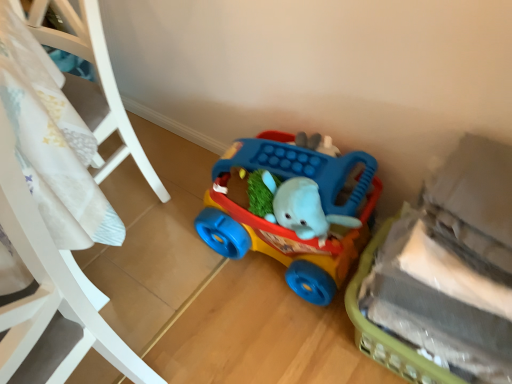
Where is `white plastic crib at left`? white plastic crib at left is located at coordinates (51, 219).

Does plush gray elephant at lower right, marked as the first toy in a front-to-back arrangement, have a greater width compared to white plastic crib at left?

No.

Consider the image. Is plush gray elephant at lower right, marked as the first toy in a front-to-back arrangement, at the left side of white plastic crib at left?

In fact, plush gray elephant at lower right, marked as the first toy in a front-to-back arrangement, is to the right of white plastic crib at left.

From a real-world perspective, between plush gray elephant at lower right, marked as the first toy in a front-to-back arrangement, and white plastic crib at left, who is vertically lower?

plush gray elephant at lower right, marked as the first toy in a front-to-back arrangement.

Which point is more distant from viewer, (448,174) or (54,86)?

The point (54,86) is behind.

Can we say rubberized plastic walker at center, the first toy when ordered from back to front, lies outside plush gray elephant at lower right, marked as the first toy in a front-to-back arrangement?

Yes.

Is rubberized plastic walker at center, the first toy when ordered from back to front, not near plush gray elephant at lower right, arranged as the second toy when viewed from the back?

No, rubberized plastic walker at center, the first toy when ordered from back to front, is not far away from plush gray elephant at lower right, arranged as the second toy when viewed from the back.

Is rubberized plastic walker at center, the first toy when ordered from back to front, oriented away from plush gray elephant at lower right, arranged as the second toy when viewed from the back?

rubberized plastic walker at center, the first toy when ordered from back to front, is not turned away from plush gray elephant at lower right, arranged as the second toy when viewed from the back.

Based on the photo, from the image's perspective, which object appears higher, rubberized plastic walker at center, the first toy when ordered from back to front, or plush gray elephant at lower right, arranged as the second toy when viewed from the back?

rubberized plastic walker at center, the first toy when ordered from back to front, from the image's perspective.

Which object is more forward, rubberized plastic walker at center, which is the 2th toy in front-to-back order, or white plastic crib at left?

white plastic crib at left.

Is rubberized plastic walker at center, the first toy when ordered from back to front, turned away from white plastic crib at left?

No, rubberized plastic walker at center, the first toy when ordered from back to front,'s orientation is not away from white plastic crib at left.

In terms of size, does rubberized plastic walker at center, which is the 2th toy in front-to-back order, appear bigger or smaller than white plastic crib at left?

In the image, rubberized plastic walker at center, which is the 2th toy in front-to-back order, appears to be smaller than white plastic crib at left.

Consider the image. Is white plastic crib at left oriented away from rubberized plastic walker at center, the first toy when ordered from back to front?

Yes, rubberized plastic walker at center, the first toy when ordered from back to front, is at the back of white plastic crib at left.

Is white plastic crib at left to the right of rubberized plastic walker at center, the first toy when ordered from back to front, from the viewer's perspective?

No.

Is white plastic crib at left in front of rubberized plastic walker at center, which is the 2th toy in front-to-back order?

Yes, it is in front of rubberized plastic walker at center, which is the 2th toy in front-to-back order.

Does point (79, 274) lie in front of point (360, 151)?

Yes.

Is plush gray elephant at lower right, marked as the first toy in a front-to-back arrangement, wider or thinner than rubberized plastic walker at center, the first toy when ordered from back to front?

In the image, plush gray elephant at lower right, marked as the first toy in a front-to-back arrangement, appears to be wider than rubberized plastic walker at center, the first toy when ordered from back to front.

Considering the sizes of objects plush gray elephant at lower right, arranged as the second toy when viewed from the back, and rubberized plastic walker at center, the first toy when ordered from back to front, in the image provided, who is shorter, plush gray elephant at lower right, arranged as the second toy when viewed from the back, or rubberized plastic walker at center, the first toy when ordered from back to front,?

rubberized plastic walker at center, the first toy when ordered from back to front.

From the image's perspective, would you say plush gray elephant at lower right, marked as the first toy in a front-to-back arrangement, is positioned over rubberized plastic walker at center, the first toy when ordered from back to front?

No, from the image's perspective, plush gray elephant at lower right, marked as the first toy in a front-to-back arrangement, is not on top of rubberized plastic walker at center, the first toy when ordered from back to front.

In terms of size, does plush gray elephant at lower right, arranged as the second toy when viewed from the back, appear bigger or smaller than rubberized plastic walker at center, the first toy when ordered from back to front?

Considering their sizes, plush gray elephant at lower right, arranged as the second toy when viewed from the back, takes up less space than rubberized plastic walker at center, the first toy when ordered from back to front.

Who is bigger, white plastic crib at left or plush gray elephant at lower right, marked as the first toy in a front-to-back arrangement?

With larger size is white plastic crib at left.

Is white plastic crib at left wider or thinner than plush gray elephant at lower right, marked as the first toy in a front-to-back arrangement?

white plastic crib at left is wider than plush gray elephant at lower right, marked as the first toy in a front-to-back arrangement.

From a real-world perspective, is white plastic crib at left located higher than plush gray elephant at lower right, marked as the first toy in a front-to-back arrangement?

Indeed, from a real-world perspective, white plastic crib at left stands above plush gray elephant at lower right, marked as the first toy in a front-to-back arrangement.

In the image, is white plastic crib at left positioned in front of or behind plush gray elephant at lower right, marked as the first toy in a front-to-back arrangement?

Clearly, white plastic crib at left is in front of plush gray elephant at lower right, marked as the first toy in a front-to-back arrangement.

The width and height of the screenshot is (512, 384). What are the coordinates of `furniture in front of the plush gray elephant at lower right, arranged as the second toy when viewed from the back` in the screenshot? It's located at (51, 219).

Where is `toy located above the rubberized plastic walker at center, the first toy when ordered from back to front (from a real-world perspective)`? toy located above the rubberized plastic walker at center, the first toy when ordered from back to front (from a real-world perspective) is located at coordinates (444, 275).

Estimate the real-world distances between objects in this image. Which object is further from rubberized plastic walker at center, the first toy when ordered from back to front, white plastic crib at left or plush gray elephant at lower right, marked as the first toy in a front-to-back arrangement?

white plastic crib at left is positioned further to the anchor rubberized plastic walker at center, the first toy when ordered from back to front.

Considering their positions, is plush gray elephant at lower right, marked as the first toy in a front-to-back arrangement, positioned closer to rubberized plastic walker at center, the first toy when ordered from back to front, than white plastic crib at left?

plush gray elephant at lower right, marked as the first toy in a front-to-back arrangement, is closer to rubberized plastic walker at center, the first toy when ordered from back to front.

Considering their positions, is rubberized plastic walker at center, which is the 2th toy in front-to-back order, positioned closer to white plastic crib at left than plush gray elephant at lower right, marked as the first toy in a front-to-back arrangement?

rubberized plastic walker at center, which is the 2th toy in front-to-back order, is positioned closer to the anchor white plastic crib at left.

Based on their spatial positions, is rubberized plastic walker at center, which is the 2th toy in front-to-back order, or white plastic crib at left further from plush gray elephant at lower right, arranged as the second toy when viewed from the back?

white plastic crib at left is further to plush gray elephant at lower right, arranged as the second toy when viewed from the back.

Considering their positions, is white plastic crib at left positioned closer to plush gray elephant at lower right, marked as the first toy in a front-to-back arrangement, than rubberized plastic walker at center, which is the 2th toy in front-to-back order?

rubberized plastic walker at center, which is the 2th toy in front-to-back order.

Considering their positions, is plush gray elephant at lower right, arranged as the second toy when viewed from the back, positioned closer to white plastic crib at left than rubberized plastic walker at center, the first toy when ordered from back to front?

rubberized plastic walker at center, the first toy when ordered from back to front, is closer to white plastic crib at left.

At what (x,y) coordinates should I click in order to perform the action: click on toy situated between white plastic crib at left and plush gray elephant at lower right, marked as the first toy in a front-to-back arrangement, from left to right. Please return your answer as a coordinate pair (x, y). Looking at the image, I should click on (286, 228).